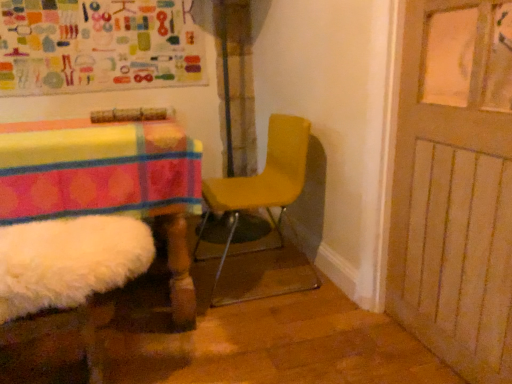
Image resolution: width=512 pixels, height=384 pixels. Find the location of `vacant space underneath yellow matte chair at center (from a real-world perspective)`. vacant space underneath yellow matte chair at center (from a real-world perspective) is located at coordinates (236, 280).